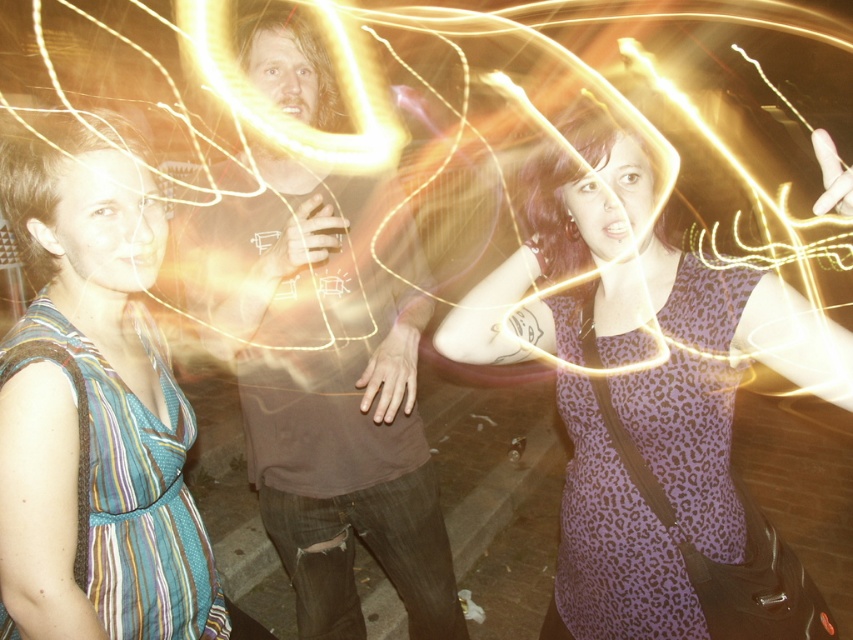
Question: From the image, what is the correct spatial relationship of brown cotton shirt at center in relation to striped fabric dress at left?

Choices:
 (A) left
 (B) right

Answer: (B)

Question: Can you confirm if purple leopard print dress at center is positioned to the left of brown cotton shirt at center?

Choices:
 (A) yes
 (B) no

Answer: (B)

Question: Which point appears farthest from the camera in this image?

Choices:
 (A) (526, 291)
 (B) (70, 625)

Answer: (A)

Question: Among these points, which one is nearest to the camera?

Choices:
 (A) (405, 490)
 (B) (65, 506)

Answer: (B)

Question: From the image, what is the correct spatial relationship of purple leopard print dress at center in relation to striped fabric dress at left?

Choices:
 (A) below
 (B) above

Answer: (B)

Question: Estimate the real-world distances between objects in this image. Which object is closer to the brown cotton shirt at center?

Choices:
 (A) purple leopard print dress at center
 (B) striped fabric dress at left

Answer: (B)